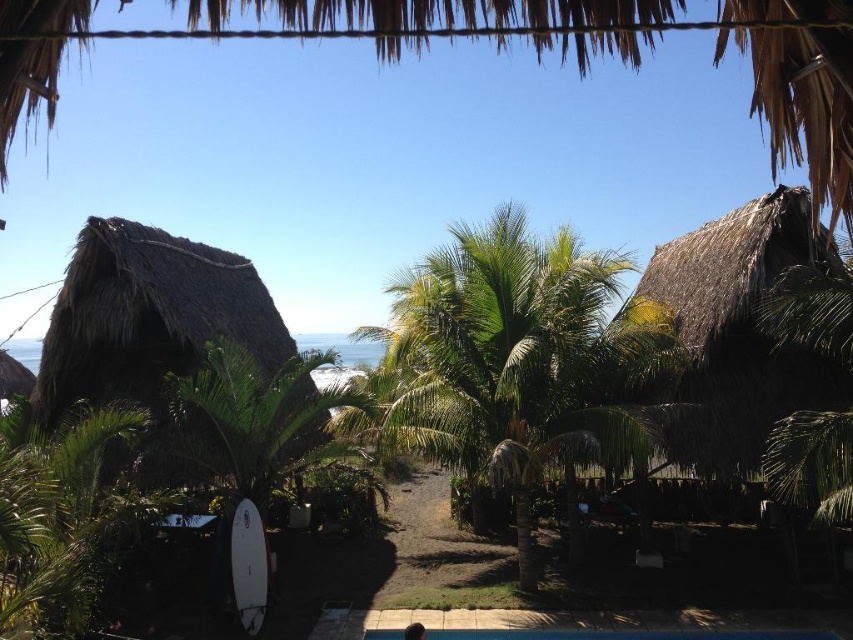
You are standing at the edge of the thatched roof structure in the foreground. You want to walk towards the white matte surfboard at lower left. Will you pass by the blue smooth pool at center on your way?

Yes, you will pass by the blue smooth pool at center on your way to the white matte surfboard at lower left because the blue smooth pool at center is closer to you than the white matte surfboard at lower left.

Based on the photo, you are standing at the beach and see the thatched roof hut at right and dark brown hair at lower center. Which object is located to the right of the other?

The thatched roof hut at right is positioned on the right side of dark brown hair at lower center.

You are a guest at this tropical resort and want to know if the blue smooth pool at center is larger than the white matte surfboard at lower left. Can you confirm this?

The blue smooth pool at center occupies less space than the white matte surfboard at lower left, so the pool is smaller than the surfboard.